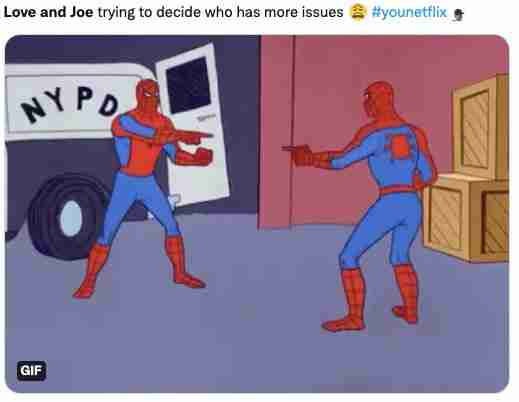
Find the location of a particular element. This screenshot has height=402, width=519. window is located at coordinates (197, 85).